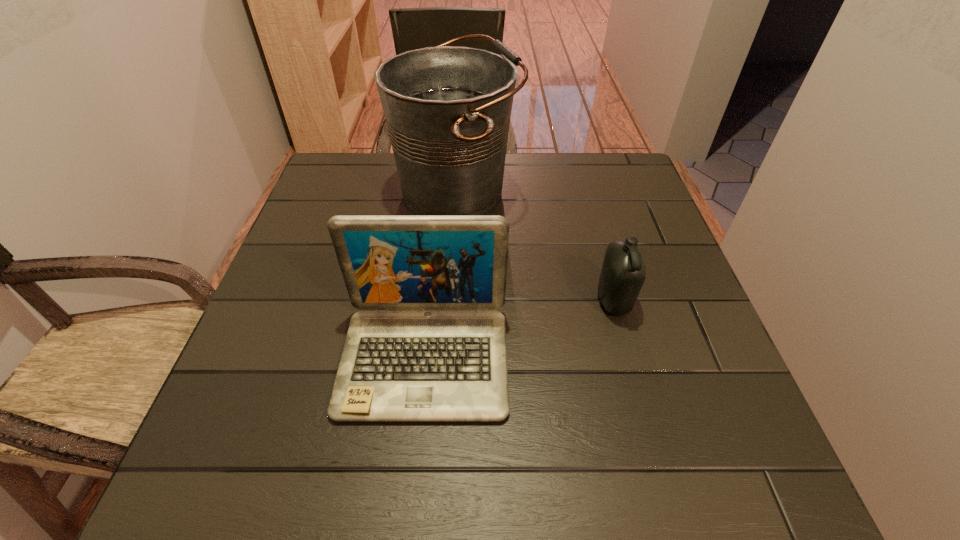
Locate an element on the screen. This screenshot has width=960, height=540. vacant region at the far edge of the desktop is located at coordinates (395, 196).

Where is `vacant space at the near edge of the desktop`? vacant space at the near edge of the desktop is located at coordinates (440, 474).

The width and height of the screenshot is (960, 540). In order to click on free location at the left edge in this screenshot , I will do `click(283, 281)`.

This screenshot has width=960, height=540. In the image, there is a desktop. In order to click on vacant space at the right edge in this screenshot , I will do `click(602, 238)`.

This screenshot has height=540, width=960. In the image, there is a desktop. In order to click on free region at the far left corner in this screenshot , I will do `click(331, 159)`.

Find the location of a particular element. The width and height of the screenshot is (960, 540). free space between the rightmost object and the tallest object is located at coordinates (535, 246).

In order to click on vacant area that lies between the shortest object and the tallest object in this screenshot , I will do `click(535, 246)`.

At what (x,y) coordinates should I click in order to perform the action: click on empty location between the bottle and the second tallest object. Please return your answer as a coordinate pair (x, y). This screenshot has width=960, height=540. Looking at the image, I should click on (518, 330).

The height and width of the screenshot is (540, 960). I want to click on empty space between the bottle and the farthest object, so [x=535, y=246].

Where is `vacant space that is in between the laptop computer and the rightmost object`? vacant space that is in between the laptop computer and the rightmost object is located at coordinates (518, 330).